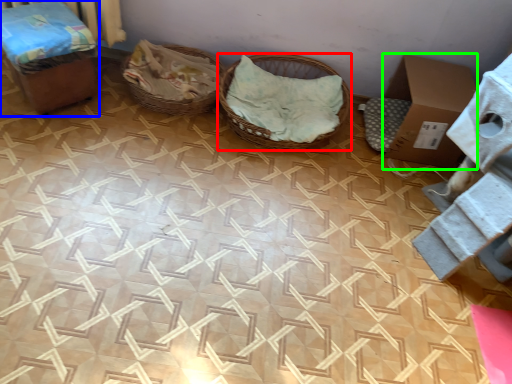
Question: Estimate the real-world distances between objects in this image. Which object is farther from basket (highlighted by a red box), furniture (highlighted by a blue box) or cardboard box (highlighted by a green box)?

Choices:
 (A) furniture
 (B) cardboard box

Answer: (A)